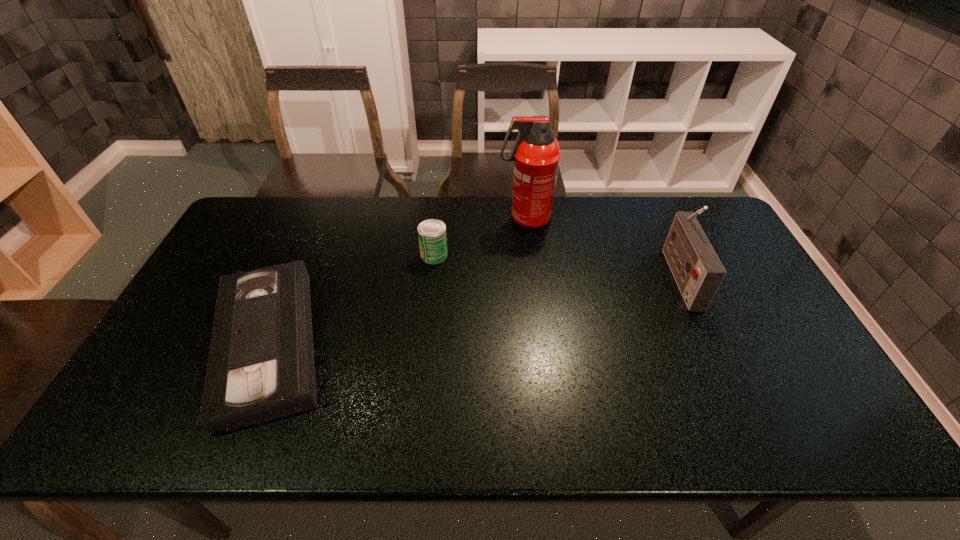
Identify the location of blank area located 0.370m on the trigger side of the farthest object. This screenshot has width=960, height=540. (392, 219).

You are a GUI agent. You are given a task and a screenshot of the screen. Output one action in this format:
    pyautogui.click(x=<x>, y=<y>)
    Task: Click on the free point located 0.230m on the front panel of the rightmost object
    The image size is (960, 540).
    Given the screenshot: What is the action you would take?
    pyautogui.click(x=594, y=276)

This screenshot has width=960, height=540. I want to click on vacant space located 0.190m on the front panel of the rightmost object, so click(608, 276).

Find the location of a particular element. vacant area situated 0.300m on the front panel of the rightmost object is located at coordinates (571, 276).

You are a GUI agent. You are given a task and a screenshot of the screen. Output one action in this format:
    pyautogui.click(x=<x>, y=<y>)
    Task: Click on the vacant space located on the left of the third object from right to left
    Image resolution: width=960 pixels, height=540 pixels.
    Given the screenshot: What is the action you would take?
    pyautogui.click(x=336, y=255)

Where is `free region located on the back of the videotape`? The width and height of the screenshot is (960, 540). free region located on the back of the videotape is located at coordinates coord(302,260).

Find the location of a particular element. object that is positioned at the far edge is located at coordinates (536, 153).

This screenshot has height=540, width=960. What are the coordinates of `object located in the near edge section of the desktop` in the screenshot? It's located at (260, 367).

The image size is (960, 540). In order to click on object that is at the left edge in this screenshot , I will do `click(260, 367)`.

Locate an element on the screen. object located at the near left corner is located at coordinates tap(260, 367).